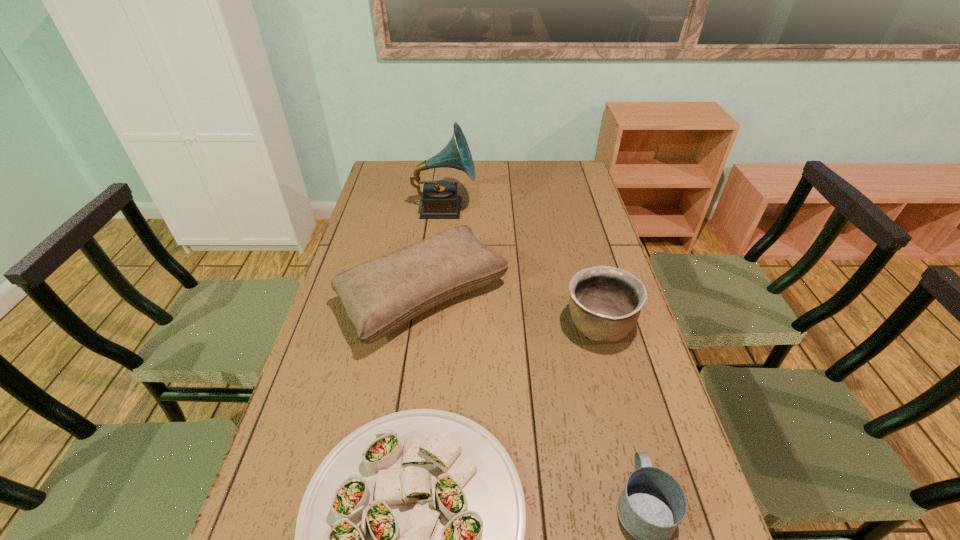
This screenshot has width=960, height=540. I want to click on free space at the left edge of the desktop, so click(346, 433).

In the image, there is a desktop. Identify the location of vacant area at the right edge. Image resolution: width=960 pixels, height=540 pixels. (609, 247).

The width and height of the screenshot is (960, 540). Find the location of `vacant space at the far right corner of the desktop`. vacant space at the far right corner of the desktop is located at coordinates (569, 165).

Where is `vacant point located between the pottery and the farthest object`? The height and width of the screenshot is (540, 960). vacant point located between the pottery and the farthest object is located at coordinates click(x=521, y=268).

This screenshot has height=540, width=960. I want to click on free space that is in between the pottery and the cushion, so click(x=512, y=313).

Find the location of a particular element. The image size is (960, 540). object that is the third nearest to the tallest object is located at coordinates (409, 539).

Identify which object is the closest to the pottery. Please provide its 2D coordinates. Your answer should be formatted as a tuple, i.e. [(x, y)], where the tuple contains the x and y coordinates of a point satisfying the conditions above.

[(380, 295)]

The image size is (960, 540). In order to click on vacant position in the image that satisfies the following two spatial constraints: 1. from the horn of the farthest object; 2. on the back side of the pottery in this screenshot , I will do `click(432, 327)`.